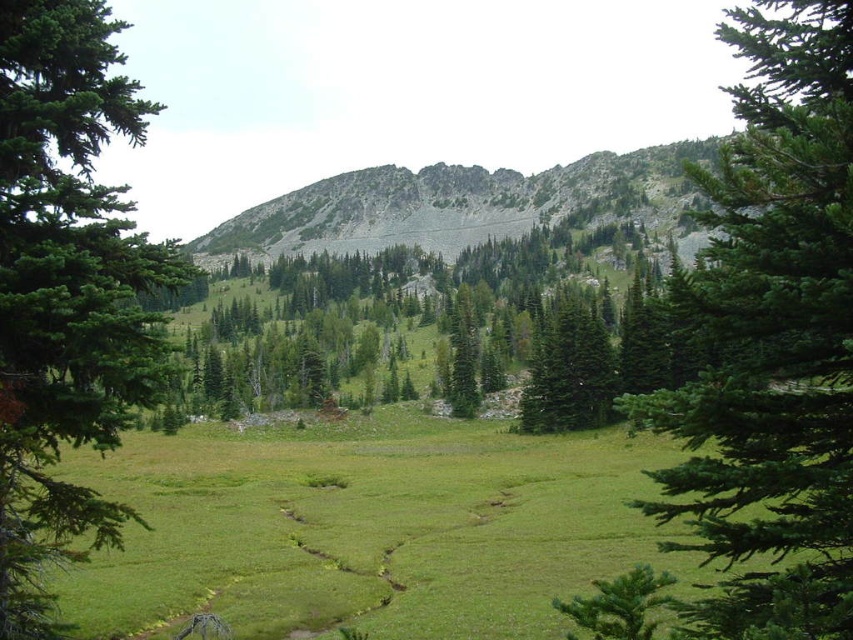
Question: Considering the real-world distances, which object is farthest from the green matte tree at center?

Choices:
 (A) gray rocky mountain at center
 (B) green needle-like tree at left

Answer: (A)

Question: Can you confirm if green textured pine tree at center is positioned to the left of green needle-like tree at left?

Choices:
 (A) yes
 (B) no

Answer: (B)

Question: Which of the following is the closest to the observer?

Choices:
 (A) (849, 545)
 (B) (601, 179)
 (C) (468, 353)

Answer: (A)

Question: Based on their relative distances, which object is nearer to the green matte tree at center?

Choices:
 (A) green textured tree at center
 (B) green textured pine tree at center

Answer: (A)

Question: Is green matte tree at center closer to the viewer compared to green textured tree at center?

Choices:
 (A) no
 (B) yes

Answer: (B)

Question: Does green needle-like tree at left appear under green textured tree at center?

Choices:
 (A) no
 (B) yes

Answer: (A)